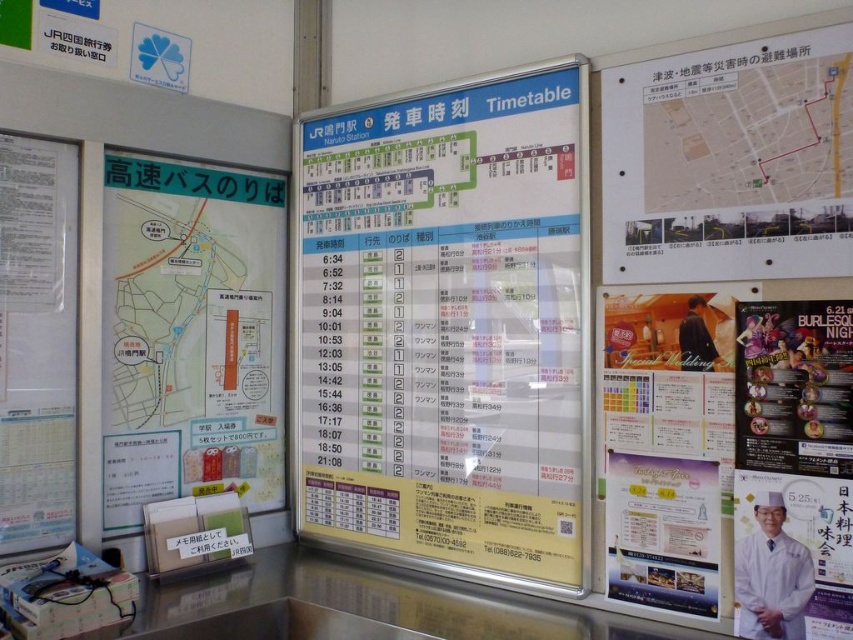
Who is shorter, matte gold frame at right or matte brown suit at center?

With less height is matte brown suit at center.

Does point (691, 410) come farther from viewer compared to point (701, 326)?

Yes.

Locate an element on the screen. The image size is (853, 640). matte gold frame at right is located at coordinates (666, 387).

Locate an element on the screen. The height and width of the screenshot is (640, 853). matte gold frame at right is located at coordinates (666, 387).

Does matte green map at left appear on the right side of white paper menu at left?

Correct, you'll find matte green map at left to the right of white paper menu at left.

Can you confirm if matte green map at left is positioned to the left of white paper menu at left?

Incorrect, matte green map at left is not on the left side of white paper menu at left.

Identify the location of matte green map at left. The height and width of the screenshot is (640, 853). (190, 333).

Find the location of a particular element. matte green map at left is located at coordinates (190, 333).

Between matte gold frame at right and white lab coat at lower right, which one appears on the left side from the viewer's perspective?

From the viewer's perspective, matte gold frame at right appears more on the left side.

Is point (724, 483) closer to viewer compared to point (747, 596)?

No, (724, 483) is further to viewer.

Does point (602, 422) come in front of point (785, 636)?

No.

Image resolution: width=853 pixels, height=640 pixels. Find the location of `matte gold frame at right`. matte gold frame at right is located at coordinates (666, 387).